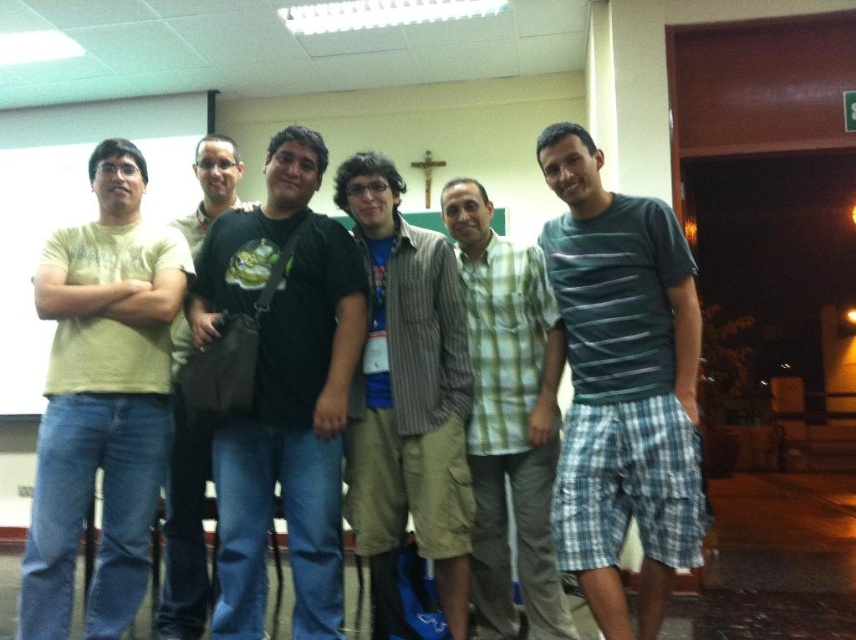
Question: Can you confirm if black cotton shirt at center is bigger than green plaid shirt at center?

Choices:
 (A) yes
 (B) no

Answer: (A)

Question: Does green striped t-shirt at center have a lesser width compared to black cotton shirt at left?

Choices:
 (A) no
 (B) yes

Answer: (A)

Question: Can you confirm if green striped t-shirt at center is positioned to the left of black cotton shirt at center?

Choices:
 (A) yes
 (B) no

Answer: (B)

Question: Which point appears farthest from the camera in this image?

Choices:
 (A) (604, 218)
 (B) (197, 448)

Answer: (B)

Question: Among these objects, which one is farthest from the camera?

Choices:
 (A) green plaid shirt at center
 (B) striped cotton shirt at center

Answer: (A)

Question: Which point is farther to the camera?

Choices:
 (A) green striped t-shirt at center
 (B) light yellow t-shirt at left
 (C) striped cotton shirt at center

Answer: (C)